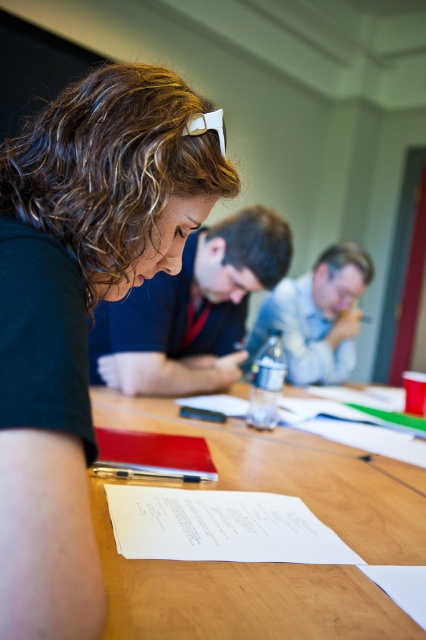
Question: Can you confirm if wooden table at center is positioned to the left of metallic silver water bottle at center?

Choices:
 (A) no
 (B) yes

Answer: (B)

Question: Is wooden table at center closer to the viewer compared to metallic silver water bottle at center?

Choices:
 (A) no
 (B) yes

Answer: (B)

Question: Which point is closer to the camera?

Choices:
 (A) wooden table at center
 (B) white paper at center
 (C) red leather notepad at lower center
 (D) metallic silver pen at center

Answer: (A)

Question: Which of the following is the closest to the observer?

Choices:
 (A) (232, 397)
 (B) (161, 545)
 (C) (25, 506)
 (D) (267, 264)

Answer: (C)

Question: Estimate the real-world distances between objects in this image. Which object is farther from the wooden table at center?

Choices:
 (A) matte black shirt at center
 (B) black matte hair at upper left
 (C) red leather notepad at lower center
 (D) white paper at center

Answer: (B)

Question: Does red leather notepad at lower center have a smaller size compared to metallic silver pen at center?

Choices:
 (A) yes
 (B) no

Answer: (B)